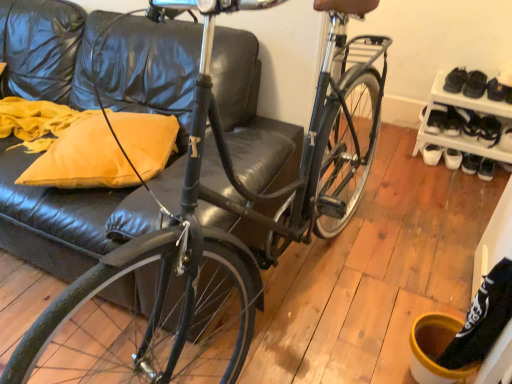
Question: From the image's perspective, is black leather shoe at right, the 2th shoe in the right-to-left sequence, below white plastic shoe rack at lower right?

Choices:
 (A) yes
 (B) no

Answer: (B)

Question: Is black leather shoe at right, the 1th shoe positioned from the left, shorter than white plastic shoe rack at lower right?

Choices:
 (A) no
 (B) yes

Answer: (B)

Question: Would you say white plastic shoe rack at lower right is part of black leather shoe at right, the 2th shoe in the right-to-left sequence,'s contents?

Choices:
 (A) yes
 (B) no

Answer: (B)

Question: Does black leather shoe at right, the 2th shoe in the right-to-left sequence, come in front of white plastic shoe rack at lower right?

Choices:
 (A) yes
 (B) no

Answer: (B)

Question: Is white plastic shoe rack at lower right at the back of black leather shoe at right, the 2th shoe in the right-to-left sequence?

Choices:
 (A) yes
 (B) no

Answer: (A)

Question: From a real-world perspective, is black leather shoe at right, the 1th shoe positioned from the left, under white plastic shoe rack at lower right?

Choices:
 (A) yes
 (B) no

Answer: (A)

Question: From the image's perspective, is black leather shoe at right, the second shoe when ordered from left to right, located beneath yellow fabric pillow at left?

Choices:
 (A) yes
 (B) no

Answer: (B)

Question: Is black leather shoe at right, acting as the 1th shoe starting from the right, taller than yellow fabric pillow at left?

Choices:
 (A) yes
 (B) no

Answer: (A)

Question: Is black leather shoe at right, acting as the 1th shoe starting from the right, positioned before yellow fabric pillow at left?

Choices:
 (A) yes
 (B) no

Answer: (B)

Question: Does black leather shoe at right, acting as the 1th shoe starting from the right, lie behind yellow fabric pillow at left?

Choices:
 (A) yes
 (B) no

Answer: (A)

Question: Is black leather shoe at right, acting as the 1th shoe starting from the right, wider than yellow fabric pillow at left?

Choices:
 (A) no
 (B) yes

Answer: (A)

Question: Is black leather shoe at right, the second shoe when ordered from left to right, to the right of yellow fabric pillow at left from the viewer's perspective?

Choices:
 (A) no
 (B) yes

Answer: (B)

Question: Does white plastic shoe rack at lower right have a lesser height compared to black leather shoe at right, the 1th shoe positioned from the left?

Choices:
 (A) no
 (B) yes

Answer: (A)